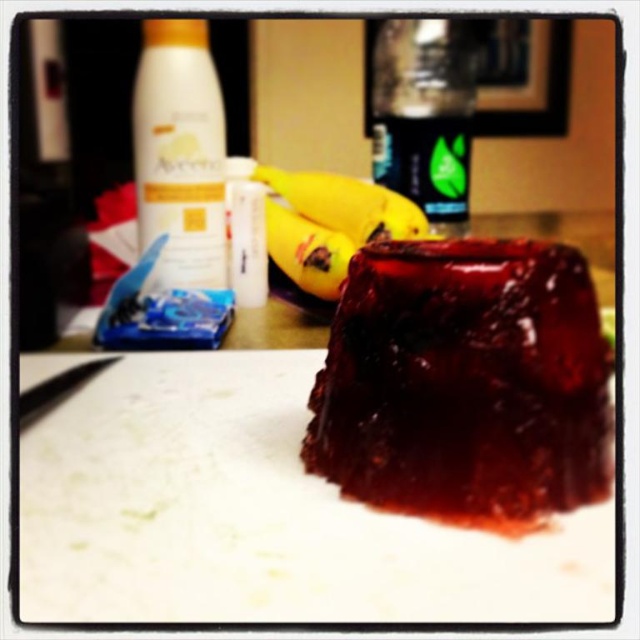
You are organizing items on the kitchen counter and see the point at coordinates (179, 156). What item is located at that point?

The point at coordinates (179, 156) corresponds to the white matte lotion at upper left.

You are a chef preparing a fruit platter and have two bananas in front of you on the countertop. The yellow smooth banana at center and the yellow rubbery banana at center. Which banana is taller?

The yellow smooth banana at center is taller than the yellow rubbery banana at center.